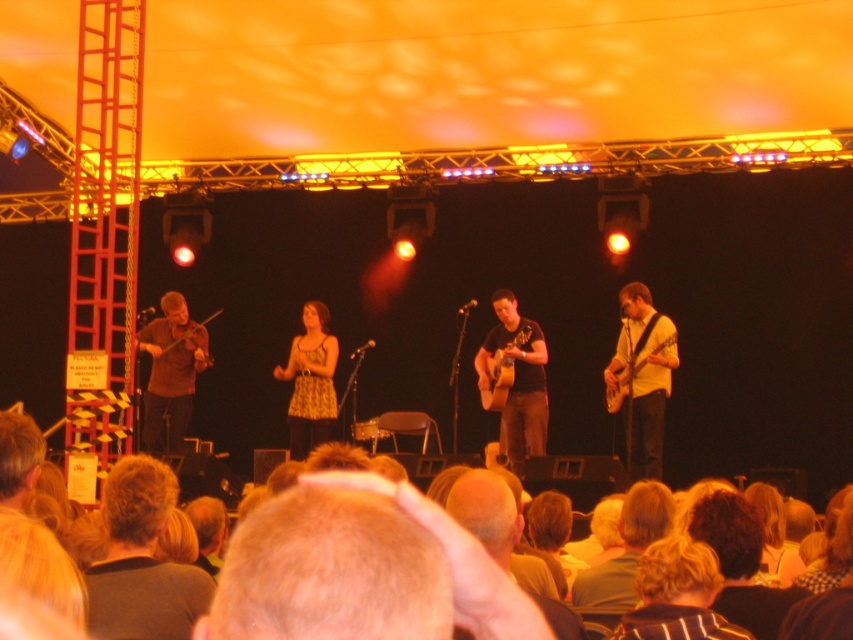
Question: Which object is farther from the camera taking this photo?

Choices:
 (A) wooden violin at left
 (B) white matte guitar at center
 (C) yellow printed dress at center

Answer: (A)

Question: Is blonde hair at lower left above acoustic wood guitar at center?

Choices:
 (A) yes
 (B) no

Answer: (B)

Question: Which of these objects is positioned closest to the white matte guitar at center?

Choices:
 (A) wooden violin at left
 (B) blonde hair at lower left

Answer: (B)

Question: Which point is closer to the camera?

Choices:
 (A) wooden violin at left
 (B) blonde hair at lower left
 (C) wooden violin at center

Answer: (B)

Question: Is acoustic wood guitar at center above wooden acoustic guitar at center?

Choices:
 (A) yes
 (B) no

Answer: (A)

Question: Can you confirm if blonde hair at lower left is smaller than white matte guitar at center?

Choices:
 (A) no
 (B) yes

Answer: (B)